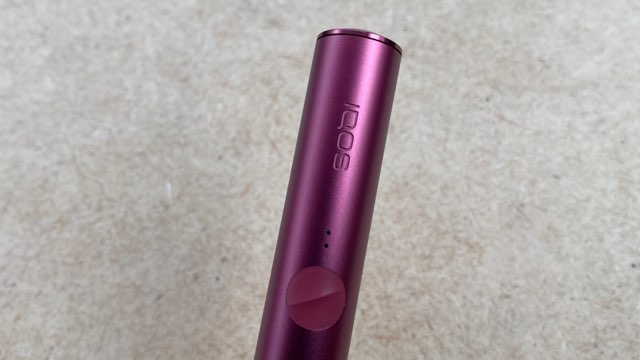
What are the coordinates of `reflection of the light in the room` in the screenshot? It's located at (352, 192).